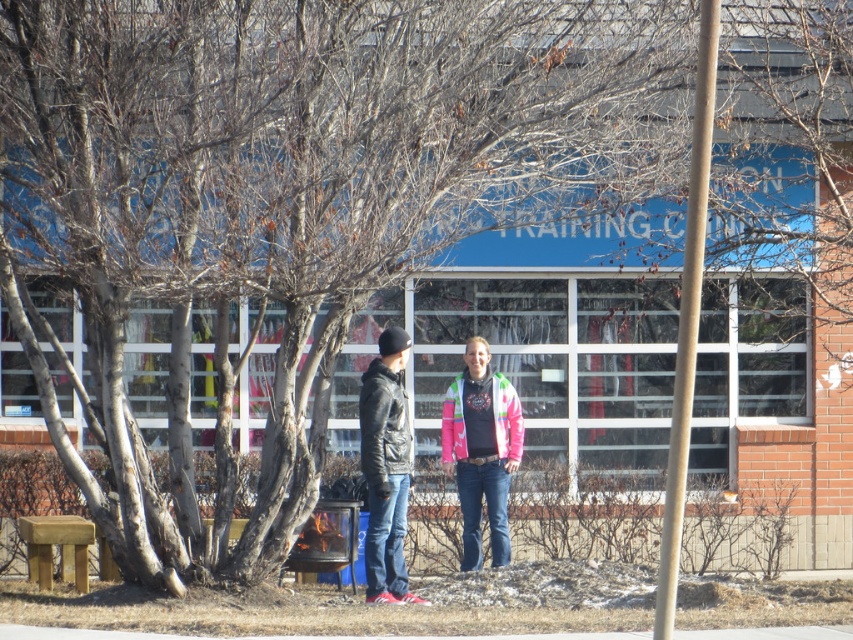
Which is behind, point (397, 344) or point (402, 396)?

Point (402, 396)

Can you confirm if pink fleece jacket at center is positioned above leather jacket at center?

Yes.

Is point (402, 436) behind point (392, 483)?

Yes, it is.

The image size is (853, 640). In order to click on pink fleece jacket at center in this screenshot , I will do pos(386,472).

Can you confirm if pink/textured jacket at center is wider than leather jacket at center?

Yes.

Does pink/textured jacket at center have a larger size compared to leather jacket at center?

Yes, pink/textured jacket at center is bigger than leather jacket at center.

Where is `pink/textured jacket at center`? pink/textured jacket at center is located at coordinates coord(480,449).

At what (x,y) coordinates should I click in order to perform the action: click on pink/textured jacket at center. Please return your answer as a coordinate pair (x, y). The width and height of the screenshot is (853, 640). Looking at the image, I should click on (480, 449).

Which is more to the left, pink fleece jacket at center or pink/textured jacket at center?

pink fleece jacket at center is more to the left.

Image resolution: width=853 pixels, height=640 pixels. What do you see at coordinates (386, 472) in the screenshot? I see `pink fleece jacket at center` at bounding box center [386, 472].

Between point (368, 563) and point (450, 410), which one is positioned in front?

Point (368, 563) is more forward.

Locate an element on the screen. The height and width of the screenshot is (640, 853). pink fleece jacket at center is located at coordinates (386, 472).